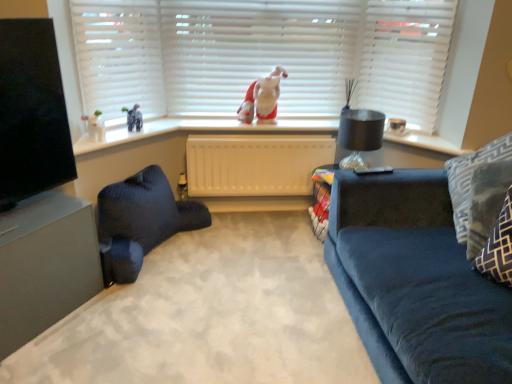
Question: From a real-world perspective, is black glass lamp at upper right located higher than velvet dark blue armchair at lower left?

Choices:
 (A) yes
 (B) no

Answer: (A)

Question: Considering the relative sizes of black glass lamp at upper right and velvet dark blue armchair at lower left in the image provided, is black glass lamp at upper right wider than velvet dark blue armchair at lower left?

Choices:
 (A) no
 (B) yes

Answer: (A)

Question: Is black glass lamp at upper right not inside velvet dark blue armchair at lower left?

Choices:
 (A) no
 (B) yes

Answer: (B)

Question: Does black glass lamp at upper right contain velvet dark blue armchair at lower left?

Choices:
 (A) no
 (B) yes

Answer: (A)

Question: Is black glass lamp at upper right to the right of velvet dark blue armchair at lower left from the viewer's perspective?

Choices:
 (A) yes
 (B) no

Answer: (A)

Question: Is velvet dark blue armchair at lower left at the back of black glass lamp at upper right?

Choices:
 (A) no
 (B) yes

Answer: (A)

Question: From a real-world perspective, is black glass lamp at upper right located higher than white matte shutter at upper right?

Choices:
 (A) yes
 (B) no

Answer: (B)

Question: From the image's perspective, is black glass lamp at upper right on white matte shutter at upper right?

Choices:
 (A) yes
 (B) no

Answer: (B)

Question: From the image's perspective, is black glass lamp at upper right located beneath white matte shutter at upper right?

Choices:
 (A) no
 (B) yes

Answer: (B)

Question: Is black glass lamp at upper right turned away from white matte shutter at upper right?

Choices:
 (A) yes
 (B) no

Answer: (B)

Question: Is black glass lamp at upper right positioned behind white matte shutter at upper right?

Choices:
 (A) no
 (B) yes

Answer: (B)

Question: Does black glass lamp at upper right appear on the right side of white matte shutter at upper right?

Choices:
 (A) yes
 (B) no

Answer: (B)

Question: Is fuzzy fabric santa at center thinner than patterned fabric pillow at right, the 2th pillow positioned from the back?

Choices:
 (A) no
 (B) yes

Answer: (B)